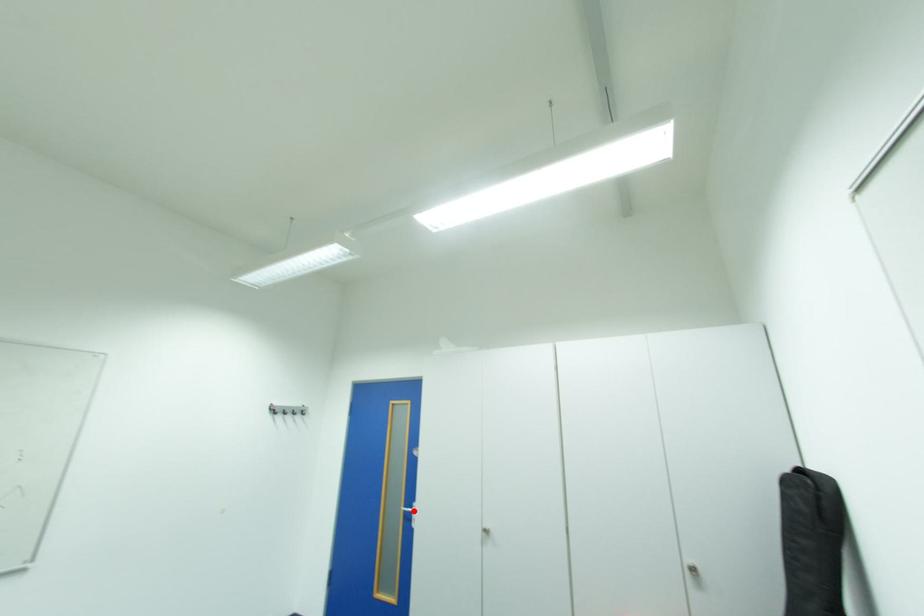
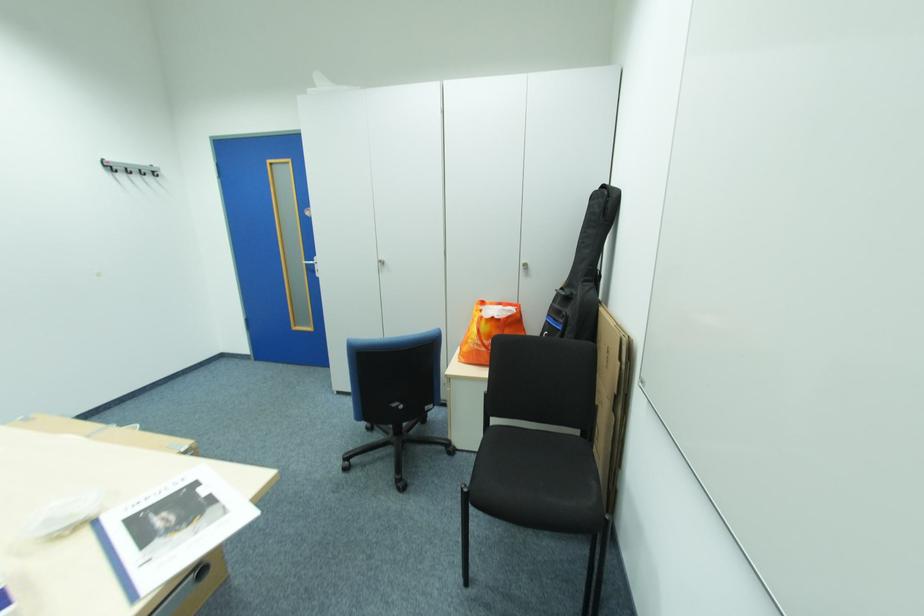
In the second image, find the point that corresponds to the highlighted location in the first image.

(314, 265)